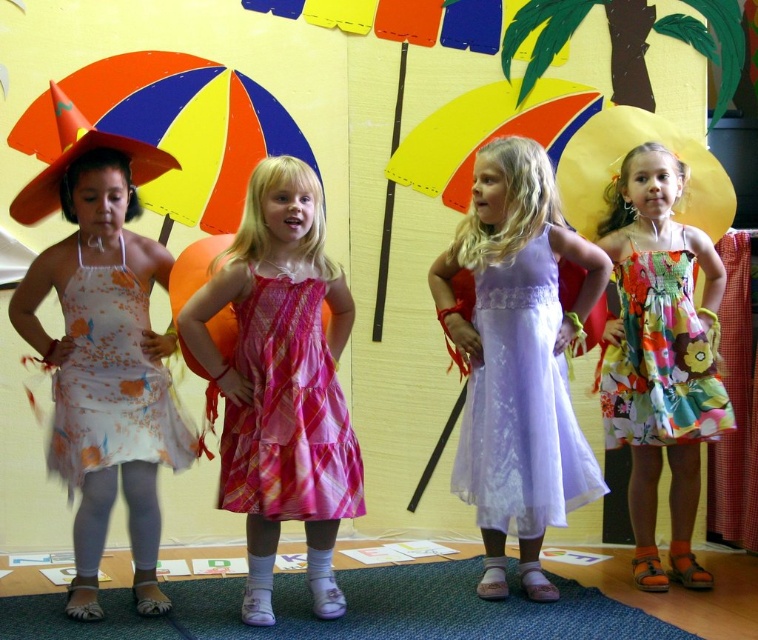
Question: Can you confirm if pink satin dress at center is bigger than yellow fabric umbrella at center?

Choices:
 (A) yes
 (B) no

Answer: (A)

Question: Which point is farther to the camera?

Choices:
 (A) (80, 477)
 (B) (149, 492)
 (C) (453, 150)
 (D) (161, 128)

Answer: (C)

Question: Is matte plastic umbrella at left wider than floral chiffon dress at left?

Choices:
 (A) yes
 (B) no

Answer: (A)

Question: From the image, what is the correct spatial relationship of lavender sheer dress at center in relation to pink plaid dress at center?

Choices:
 (A) above
 (B) below

Answer: (A)

Question: Based on their relative distances, which object is nearer to the floral cotton dress at center?

Choices:
 (A) floral chiffon dress at left
 (B) floral chiffon dress at right

Answer: (B)

Question: Which of the following is the closest to the observer?

Choices:
 (A) pink satin dress at center
 (B) matte plastic umbrella at left
 (C) matte floral dress at left
 (D) lavender sheer dress at center

Answer: (A)